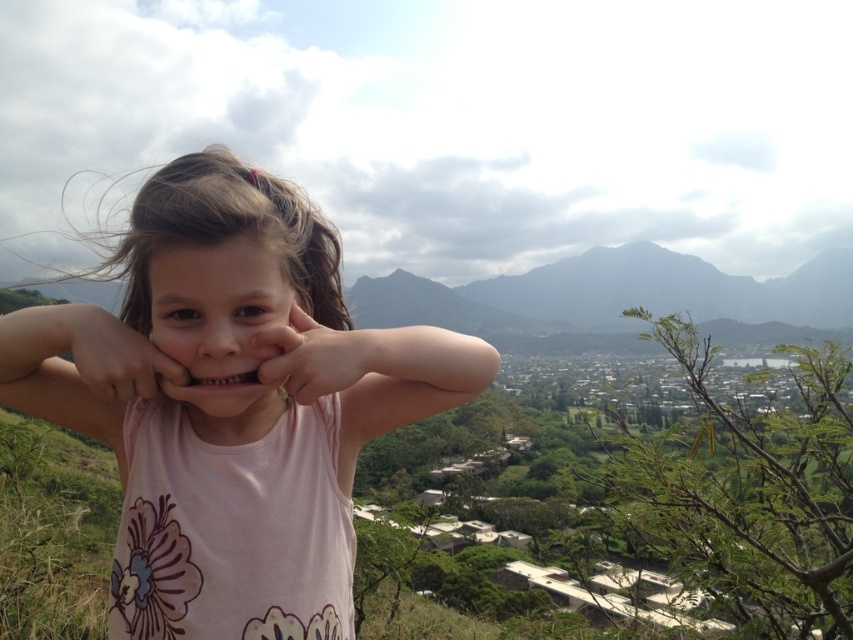
Question: Can you confirm if pink fabric shirt at center is positioned to the right of matte pink shirt at center?

Choices:
 (A) no
 (B) yes

Answer: (B)

Question: Which object is positioned farthest from the matte skin hand at center?

Choices:
 (A) smooth skin face at center
 (B) pink fabric hand at center

Answer: (B)

Question: Which point appears closest to the camera in this image?

Choices:
 (A) (184, 384)
 (B) (293, 378)

Answer: (A)

Question: Which point is closer to the camera?

Choices:
 (A) (54, 420)
 (B) (68, 330)
 (C) (218, 426)

Answer: (B)

Question: Is pink fabric shirt at center bigger than pink fabric hand at center?

Choices:
 (A) no
 (B) yes

Answer: (B)

Question: Does matte pink shirt at center appear under matte skin hand at center?

Choices:
 (A) no
 (B) yes

Answer: (B)